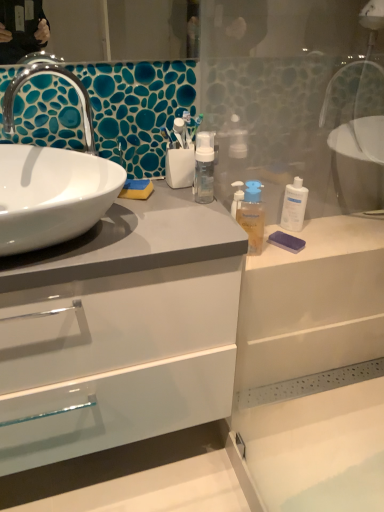
Where is `vacant region to the right of white glossy sink at left`? This screenshot has height=512, width=384. vacant region to the right of white glossy sink at left is located at coordinates (149, 207).